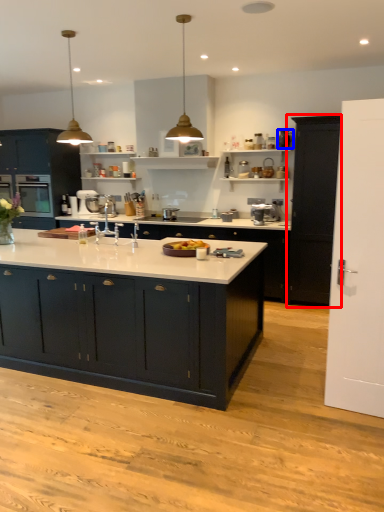
Question: Which object is further to the camera taking this photo, cabinetry (highlighted by a red box) or appliance (highlighted by a blue box)?

Choices:
 (A) cabinetry
 (B) appliance

Answer: (B)